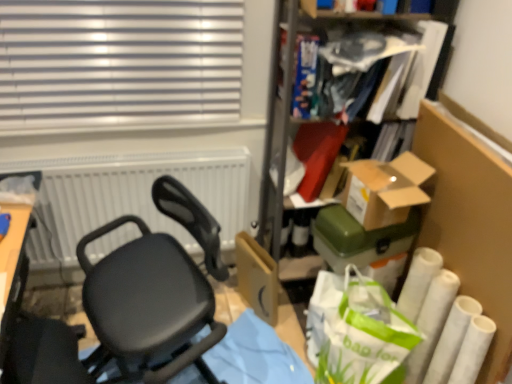
Question: Is brown cardboard box at upper right, which ranks as the 2th box in bottom-to-top order, to the right of cardboard box at center from the viewer's perspective?

Choices:
 (A) no
 (B) yes

Answer: (B)

Question: Is brown cardboard box at upper right, which is counted as the first box, starting from the top, positioned with its back to cardboard box at center?

Choices:
 (A) yes
 (B) no

Answer: (B)

Question: Considering the relative positions of brown cardboard box at upper right, which ranks as the 2th box in bottom-to-top order, and cardboard box at center in the image provided, is brown cardboard box at upper right, which ranks as the 2th box in bottom-to-top order, to the left of cardboard box at center from the viewer's perspective?

Choices:
 (A) no
 (B) yes

Answer: (A)

Question: Is cardboard box at center inside brown cardboard box at upper right, which ranks as the 2th box in bottom-to-top order?

Choices:
 (A) yes
 (B) no

Answer: (B)

Question: Is brown cardboard box at upper right, which is counted as the first box, starting from the top, closer to camera compared to cardboard box at center?

Choices:
 (A) no
 (B) yes

Answer: (B)

Question: Looking at the image, does green matte box at center-right, the first box when ordered from bottom to top, seem bigger or smaller compared to black matte chair at center?

Choices:
 (A) small
 (B) big

Answer: (A)

Question: From a real-world perspective, relative to black matte chair at center, is green matte box at center-right, the first box when ordered from bottom to top, vertically above or below?

Choices:
 (A) above
 (B) below

Answer: (A)

Question: From their relative heights in the image, would you say green matte box at center-right, the 2th box from the top, is taller or shorter than black matte chair at center?

Choices:
 (A) tall
 (B) short

Answer: (B)

Question: Which is correct: green matte box at center-right, the first box when ordered from bottom to top, is inside black matte chair at center, or outside of it?

Choices:
 (A) outside
 (B) inside

Answer: (A)

Question: Is blue paperback book at upper right, which ranks as the 2th book in right-to-left order, spatially inside cardboard box at center, or outside of it?

Choices:
 (A) inside
 (B) outside

Answer: (B)

Question: Looking at their shapes, would you say blue paperback book at upper right, which appears as the first book when viewed from the left, is wider or thinner than cardboard box at center?

Choices:
 (A) wide
 (B) thin

Answer: (A)

Question: Visually, is blue paperback book at upper right, which ranks as the 2th book in right-to-left order, positioned to the left or to the right of cardboard box at center?

Choices:
 (A) left
 (B) right

Answer: (B)

Question: Considering the positions of blue paperback book at upper right, which ranks as the 2th book in right-to-left order, and cardboard box at center in the image, is blue paperback book at upper right, which ranks as the 2th book in right-to-left order, taller or shorter than cardboard box at center?

Choices:
 (A) short
 (B) tall

Answer: (A)

Question: From a real-world perspective, is cardboard box at center physically located above or below green paper shopping bag at lower right?

Choices:
 (A) below
 (B) above

Answer: (A)

Question: Is cardboard box at center inside or outside of green paper shopping bag at lower right?

Choices:
 (A) inside
 (B) outside

Answer: (B)